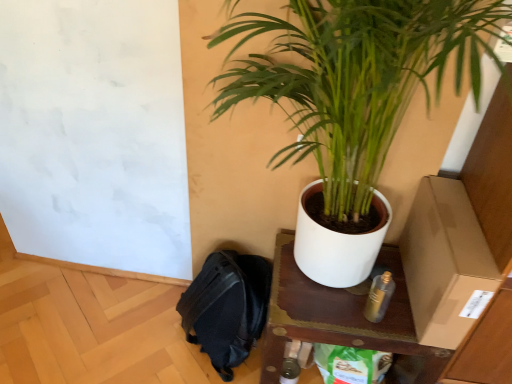
The image size is (512, 384). Identify the location of vacant space situated above wooden table at center (from a real-world perspective). (353, 294).